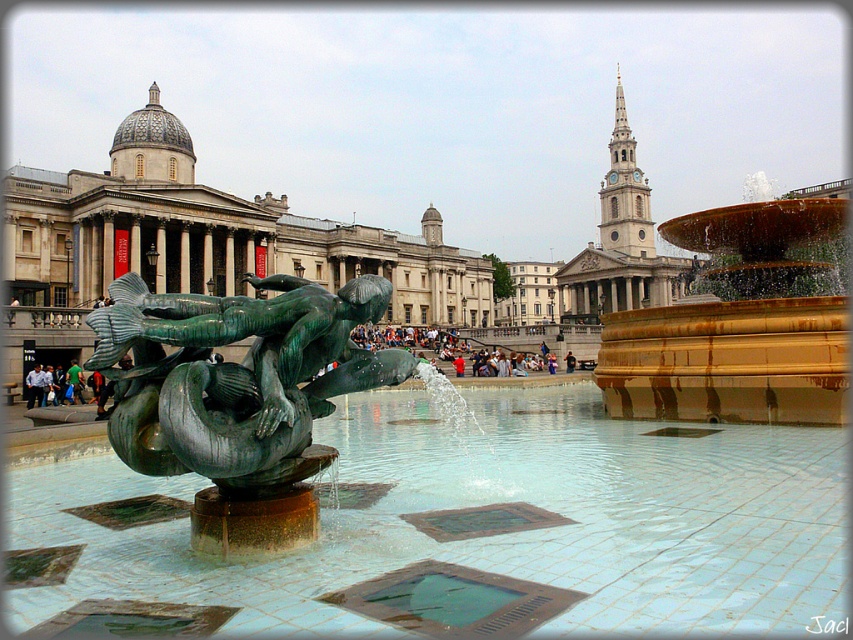
Question: Does bronze textured sculpture at center appear on the left side of green patina stone at center?

Choices:
 (A) no
 (B) yes

Answer: (A)

Question: Which point appears closest to the camera in this image?

Choices:
 (A) (819, 518)
 (B) (383, 579)
 (C) (45, 628)
 (D) (424, 525)

Answer: (C)

Question: Does green stone square at center have a lesser width compared to white shirt at center?

Choices:
 (A) yes
 (B) no

Answer: (A)

Question: Among these objects, which one is farthest from the camera?

Choices:
 (A) brass/bronze square at center
 (B) bronze textured sculpture at center
 (C) gold metallic fountain at center

Answer: (C)

Question: Estimate the real-world distances between objects in this image. Which object is closer to the clear water at fountain center?

Choices:
 (A) brass/bronze square at center
 (B) metallic square at center

Answer: (A)

Question: Can you confirm if bronze textured sculpture at center is smaller than green patina stone at center?

Choices:
 (A) no
 (B) yes

Answer: (A)